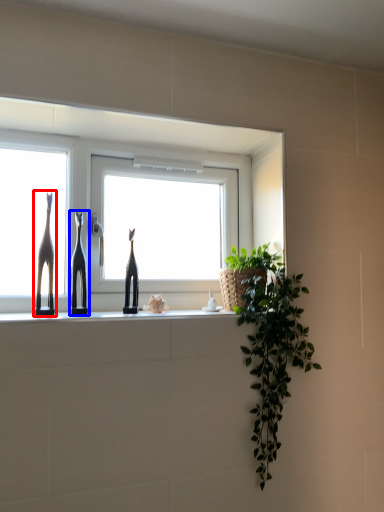
Question: Which object appears closest to the camera in this image, giraffe (highlighted by a red box) or sculpture (highlighted by a blue box)?

Choices:
 (A) giraffe
 (B) sculpture

Answer: (A)